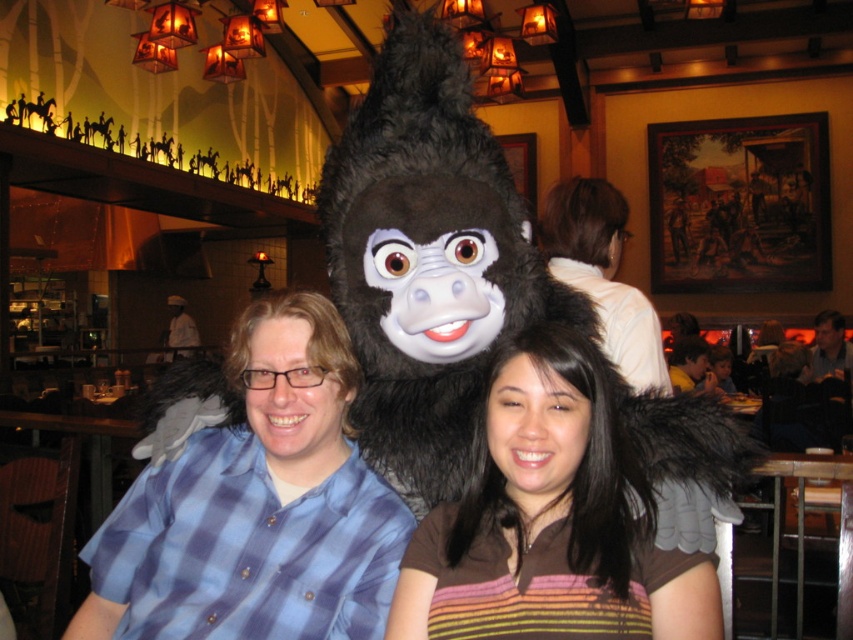
Question: Does fuzzy black gorilla at center appear under gray fabric shirt at center?

Choices:
 (A) yes
 (B) no

Answer: (B)

Question: Considering the real-world distances, which object is farthest from the blue plaid shirt at center?

Choices:
 (A) gray fabric shirt at center
 (B) fuzzy black gorilla at center
 (C) smooth brown hair at center
 (D) white shirt at upper center

Answer: (A)

Question: Among these objects, which one is farthest from the camera?

Choices:
 (A) smooth brown hair at center
 (B) gray fabric shirt at center
 (C) fuzzy black gorilla at center
 (D) white shirt at upper center

Answer: (B)

Question: Does blue plaid shirt at center appear under gray fabric shirt at center?

Choices:
 (A) yes
 (B) no

Answer: (A)

Question: Considering the real-world distances, which object is farthest from the fuzzy black gorilla at center?

Choices:
 (A) brown striped shirt at center
 (B) blue plaid shirt at center
 (C) white shirt at center

Answer: (C)

Question: Can you confirm if blue plaid shirt at center is positioned to the left of fuzzy black gorilla at center?

Choices:
 (A) yes
 (B) no

Answer: (A)